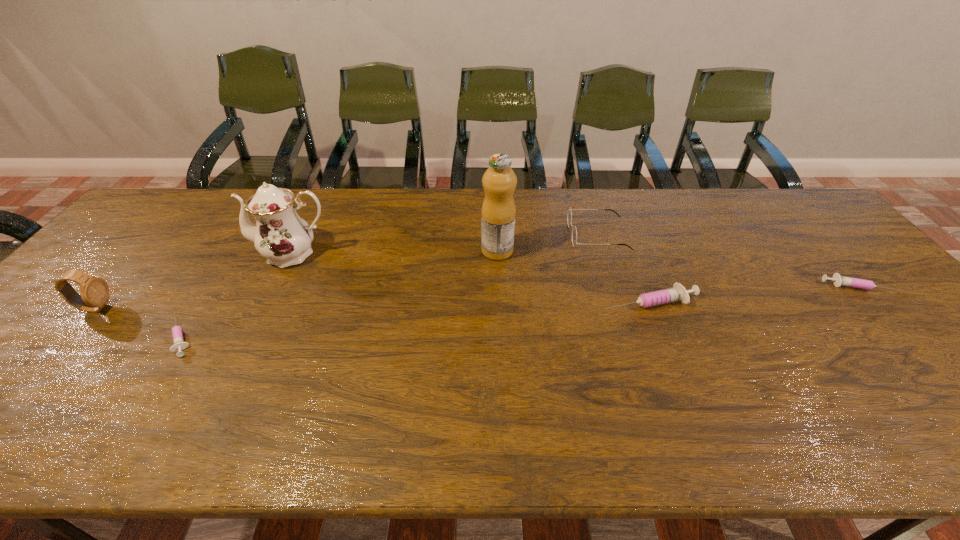
This screenshot has height=540, width=960. In order to click on watch in this screenshot , I will do `click(94, 291)`.

Where is `the tallest object`? This screenshot has height=540, width=960. the tallest object is located at coordinates (499, 181).

Locate an element on the screen. The height and width of the screenshot is (540, 960). fruit juice is located at coordinates (499, 181).

I want to click on free space located 0.080m on the left of the second object from left to right, so (x=130, y=337).

Identify the location of free spot located on the front of the fifth tallest object. The height and width of the screenshot is (540, 960). (660, 330).

Image resolution: width=960 pixels, height=540 pixels. What are the coordinates of `blank space located 0.210m on the back of the second shortest object` in the screenshot? It's located at (809, 232).

This screenshot has width=960, height=540. In order to click on free location located on the front of the sixth shortest object in this screenshot , I will do `click(271, 300)`.

The height and width of the screenshot is (540, 960). What are the coordinates of `free space located on the front-facing side of the spectacles` in the screenshot? It's located at pyautogui.click(x=445, y=235).

Where is `blank space located on the front-facing side of the spectacles`? The image size is (960, 540). blank space located on the front-facing side of the spectacles is located at coordinates (488, 235).

Where is `vacant space located 0.250m on the front-facing side of the spectacles`? This screenshot has height=540, width=960. vacant space located 0.250m on the front-facing side of the spectacles is located at coordinates (488, 235).